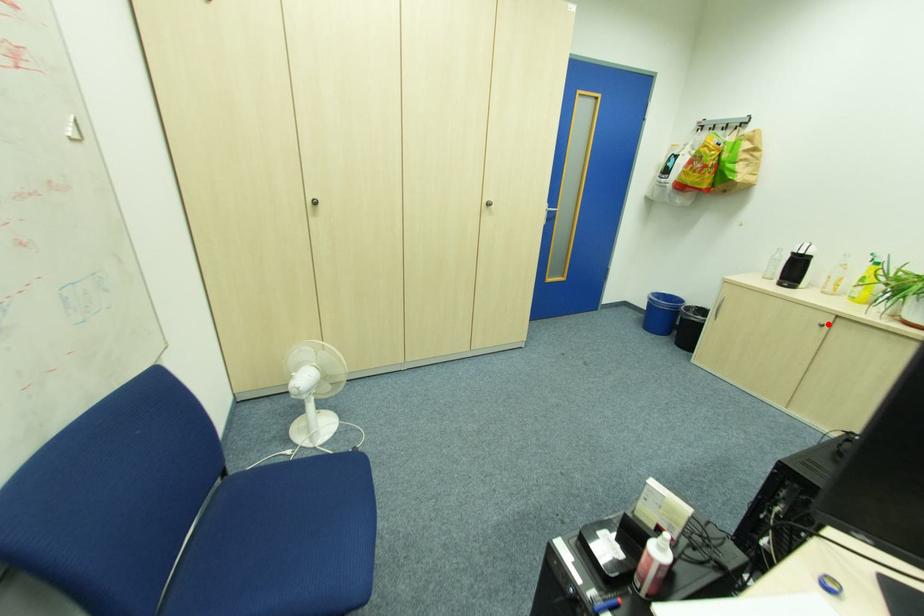
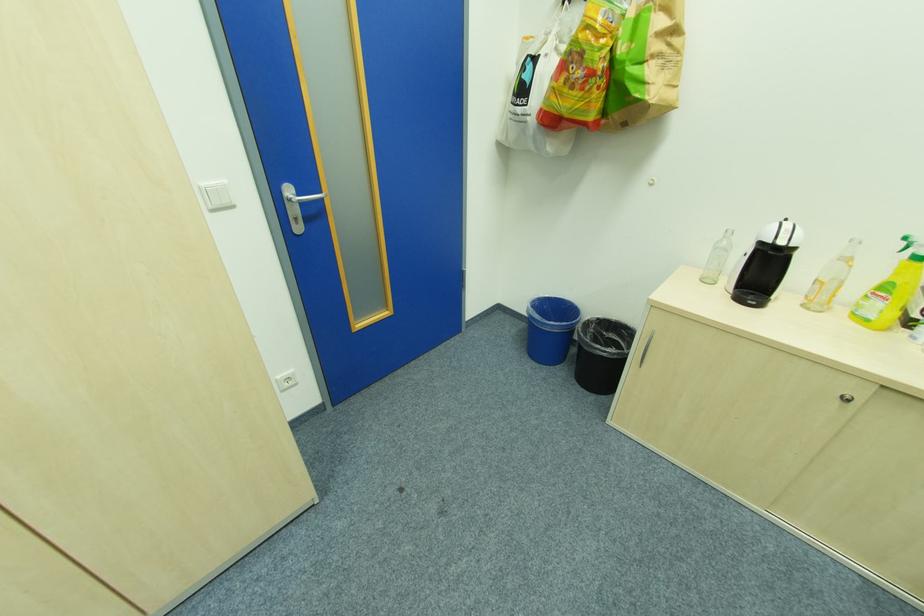
In the second image, find the point that corresponds to the highlighted location in the first image.

(852, 395)